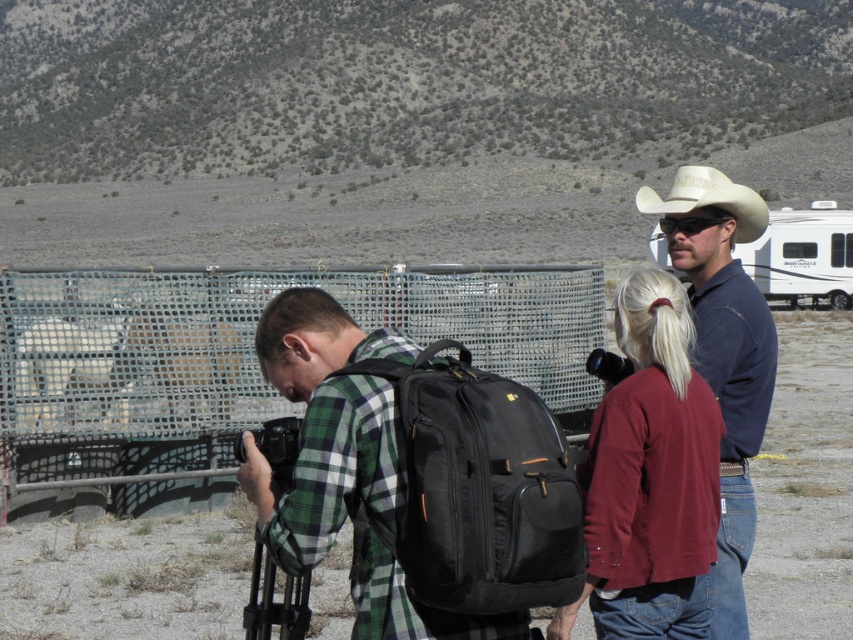
Is point (558, 269) positioned in front of point (511, 420)?

No, it is not.

I want to click on metal mesh fence at center, so click(x=235, y=365).

Which is behind, point (738, 547) or point (811, 244)?

The point (811, 244) is behind.

Can you confirm if matte blue shirt at center is taller than white plastic recreational vehicle at upper right?

No, matte blue shirt at center is not taller than white plastic recreational vehicle at upper right.

You are a GUI agent. You are given a task and a screenshot of the screen. Output one action in this format:
    pyautogui.click(x=<x>, y=<y>)
    Task: Click on the matte blue shirt at center
    
    Given the screenshot: What is the action you would take?
    pyautogui.click(x=724, y=349)

At what (x,y) coordinates should I click in order to perform the action: click on matte blue shirt at center. Please return your answer as a coordinate pair (x, y). This screenshot has height=640, width=853. Looking at the image, I should click on (724, 349).

Between white plastic recreational vehicle at upper right and white leather cowboy hat at upper right, which one is positioned higher?

white leather cowboy hat at upper right is above.

Between point (758, 250) and point (691, 196), which one is positioned behind?

The point (758, 250) is more distant.

Who is more distant from viewer, (828, 220) or (735, 195)?

The point (828, 220) is behind.

Locate an element on the screen. The image size is (853, 640). white plastic recreational vehicle at upper right is located at coordinates (802, 256).